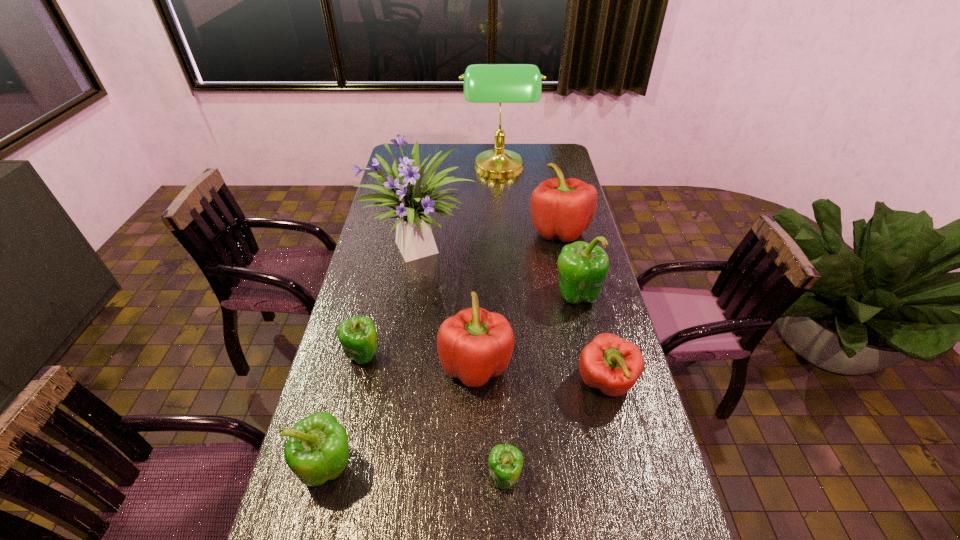
Find the location of a particular element. The height and width of the screenshot is (540, 960). green lamp is located at coordinates (483, 83).

Locate an element on the screen. This screenshot has height=540, width=960. lamp is located at coordinates (483, 83).

Image resolution: width=960 pixels, height=540 pixels. Identify the location of flower arrangement. click(x=412, y=201).

I want to click on the second farthest bell pepper, so click(x=583, y=268).

In order to click on the rightmost green bell pepper in this screenshot , I will do `click(583, 268)`.

Image resolution: width=960 pixels, height=540 pixels. I want to click on the farthest bell pepper, so click(560, 208).

The image size is (960, 540). I want to click on the farthest pink bell pepper, so click(x=560, y=208).

Where is `the second biggest green bell pepper`? the second biggest green bell pepper is located at coordinates (317, 450).

Where is `the second smallest pink bell pepper`? The width and height of the screenshot is (960, 540). the second smallest pink bell pepper is located at coordinates (475, 344).

Identify the location of the second farthest green bell pepper. The width and height of the screenshot is (960, 540). (358, 337).